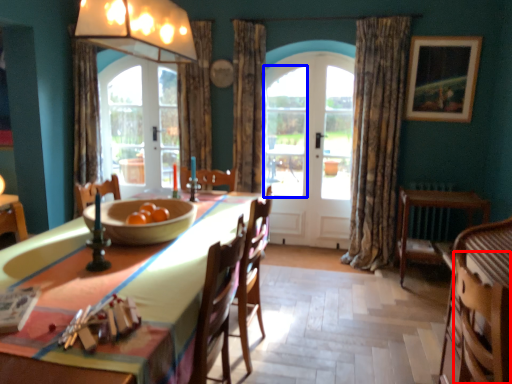
Question: Which object appears closest to the camera in this image, armchair (highlighted by a red box) or window (highlighted by a blue box)?

Choices:
 (A) armchair
 (B) window

Answer: (A)